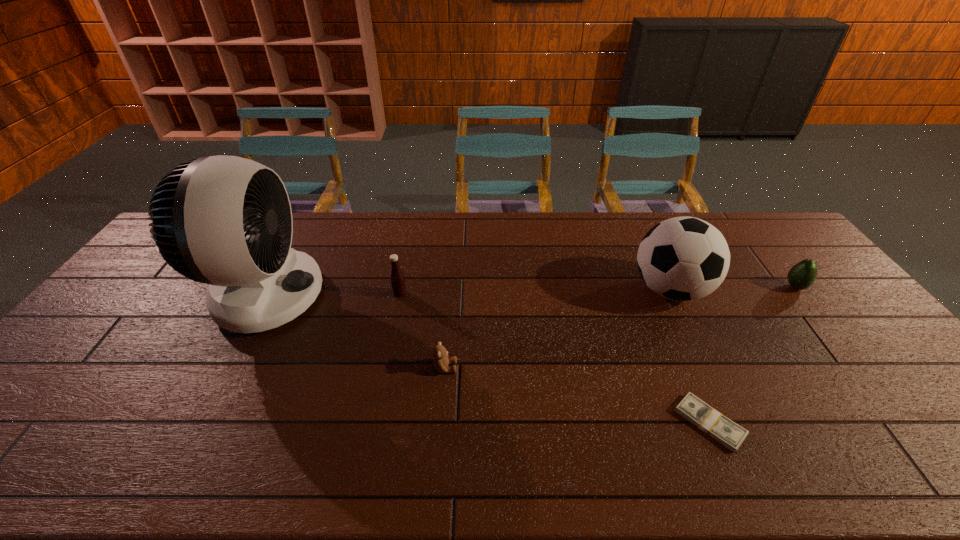
Locate an element on the screen. The width and height of the screenshot is (960, 540). the shortest object is located at coordinates (728, 433).

Find the location of a particular element. free space located 0.180m on the grille of the leftmost object is located at coordinates (381, 296).

This screenshot has width=960, height=540. I want to click on blank area located on the right of the fifth shortest object, so click(790, 290).

At what (x,y) coordinates should I click in order to perform the action: click on vacant area situated 0.260m on the front of the fifth object from right to left. Please return your answer as a coordinate pair (x, y). This screenshot has height=540, width=960. Looking at the image, I should click on click(x=385, y=367).

What are the coordinates of `free region located 0.320m on the back of the rightmost object` in the screenshot? It's located at (744, 223).

The image size is (960, 540). I want to click on vacant space located on the face of the second nearest object, so click(x=538, y=368).

Where is `free location located on the right of the nearest object`? free location located on the right of the nearest object is located at coordinates (809, 423).

Identify the location of object that is at the near edge. (728, 433).

Locate an element on the screen. object situated at the right edge is located at coordinates (801, 276).

At what (x,y) coordinates should I click in order to perform the action: click on free region at the far edge of the desktop. Please return your answer as a coordinate pair (x, y). Looking at the image, I should click on (617, 239).